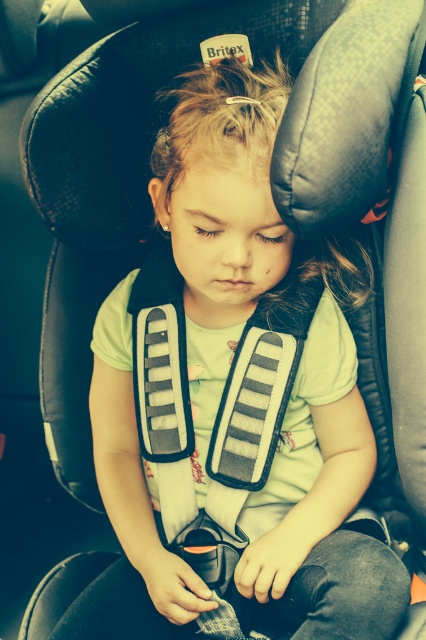
From the picture: You are a safety inspector checking the car seat setup. You notice two vests at the center of the car seat. Which vest is taller, the green matte vest at center or the matte gray safety vest at center?

The green matte vest at center is much taller than the matte gray safety vest at center according to the description.

You are a safety inspector checking the car seat. You notice two safety vests, the green matte vest at center and the matte gray safety vest at center. Which one is closer to the child?

The green matte vest at center and the matte gray safety vest at center are 2.54 inches apart. Since 2.54 inches is exactly 1 inch, the distance between them is equal, so neither is closer. However, this might indicate they are placed side by side or at the same distance from the child.

The child is wearing a light green short sleeved shirt. Where is the green matte vest at center located in the image?

The green matte vest at center is located at point (299, 364).